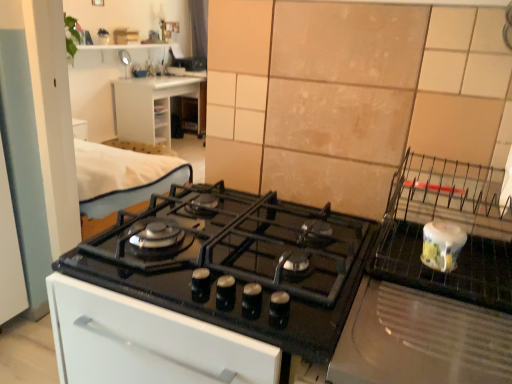
In order to click on vacant area that is in front of porcelain yellow jar at right in this screenshot , I will do `click(436, 288)`.